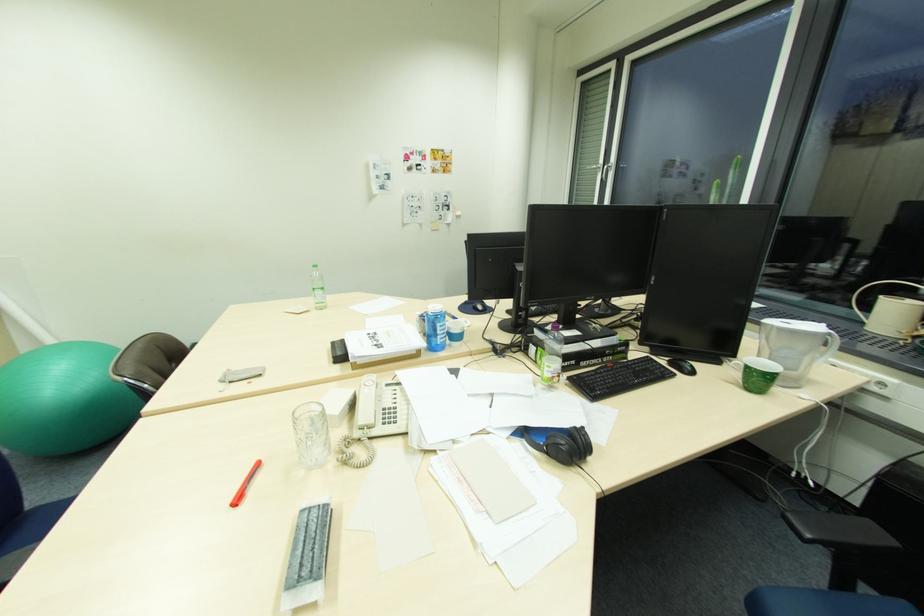
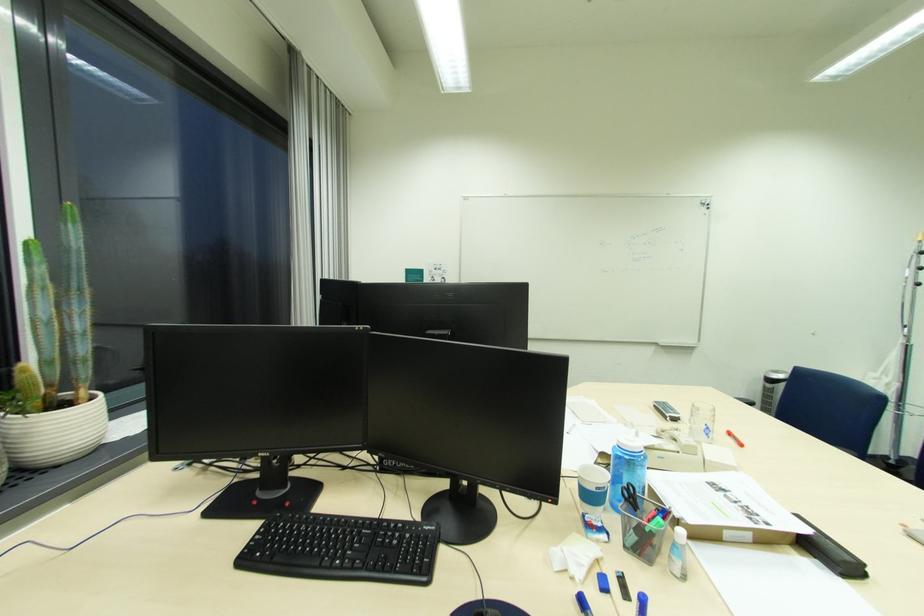
Locate, in the second image, the point that corresponds to point 739,169 in the first image.

(79, 225)